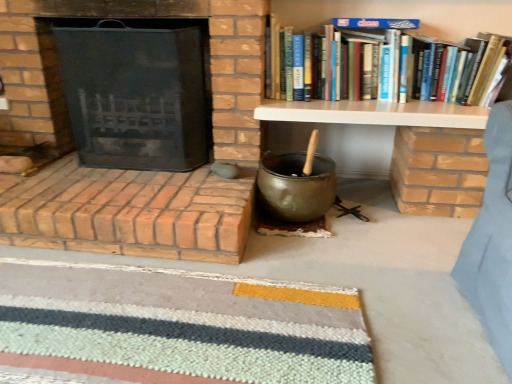
This screenshot has width=512, height=384. Identify the location of vacant area that lies to the right of striped wool doormat at lower center. (383, 271).